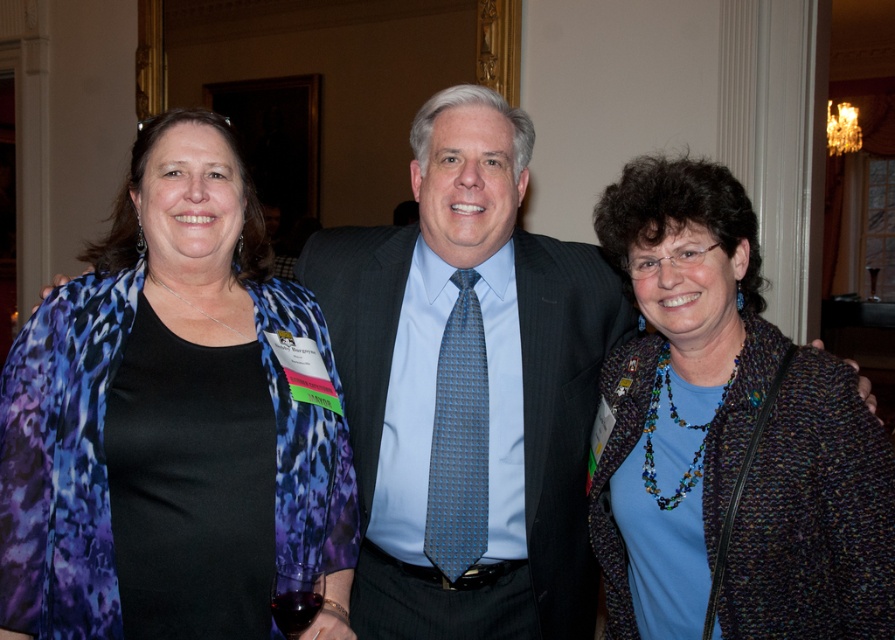
Question: Which is nearer to the blue textured tie at center?

Choices:
 (A) dark gray pinstripe suit at center
 (B) multicolored knitted sweater at center

Answer: (A)

Question: Does matte black shirt at center have a larger size compared to multicolored knitted sweater at center?

Choices:
 (A) yes
 (B) no

Answer: (A)

Question: Can you confirm if matte black shirt at center is positioned to the right of dark gray pinstripe suit at center?

Choices:
 (A) yes
 (B) no

Answer: (B)

Question: Can you confirm if multicolored knitted sweater at center is smaller than dark gray pinstripe suit at center?

Choices:
 (A) yes
 (B) no

Answer: (B)

Question: Which point appears farthest from the camera in this image?

Choices:
 (A) (458, 529)
 (B) (661, 605)

Answer: (A)

Question: Which of these objects is positioned farthest from the blue textured tie at center?

Choices:
 (A) dark gray pinstripe suit at center
 (B) matte black shirt at center
 (C) multicolored knitted sweater at center

Answer: (B)